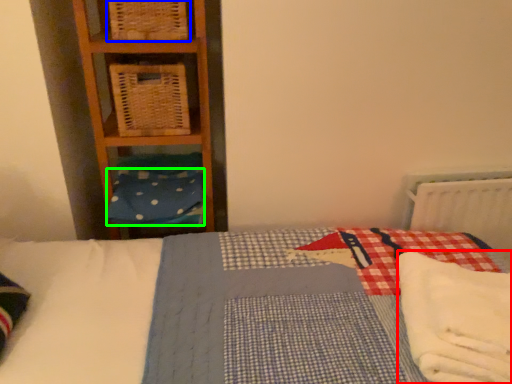
Question: Which is farther away from material (highlighted by a red box)? crate (highlighted by a blue box) or pillow (highlighted by a green box)?

Choices:
 (A) crate
 (B) pillow

Answer: (A)